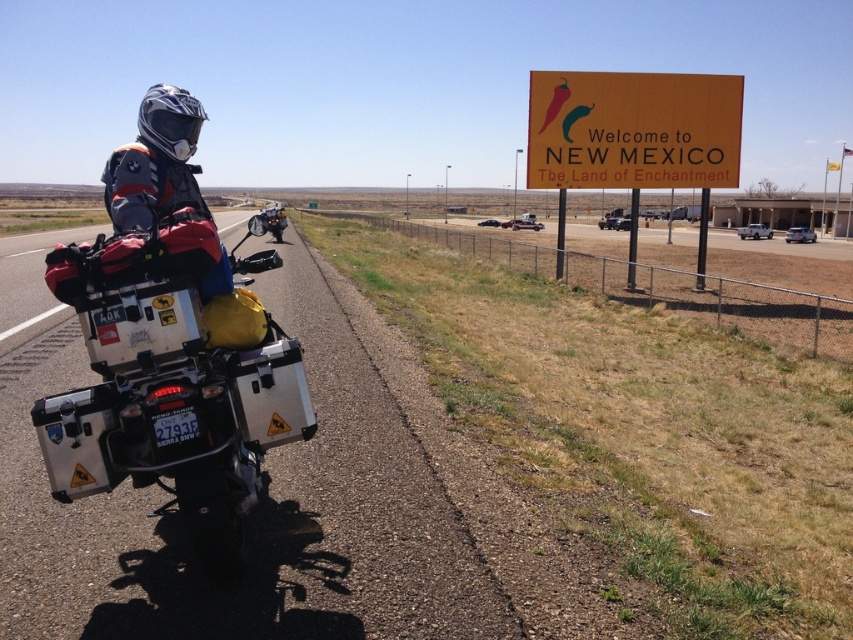
You are a traveler who just arrived in New Mexico. You see the metallic silver motorcycle at left and the yellow matte sign at upper right. How far apart are these two objects from each other?

The metallic silver motorcycle at left is 11.56 meters away from the yellow matte sign at upper right.

You are a driver approaching the yellow matte sign at upper right while driving on the highway. The distance between you and the sign is 19.48 meters. If your car is traveling at 60 km per hour, will you have enough time to slow down and read the sign before passing it?

The distance between the yellow matte sign at upper right and the viewer is 19.48 meters. At 60 km per hour, which converts to approximately 16.67 meters per second, it would take about 1.17 seconds to reach the sign. This provides sufficient time to safely slow down and read the sign before passing it.

You are a delivery driver who needs to pass through the highway scene shown. Your delivery truck is 15 feet long. Can you safely navigate between the silver metallic motorcycle at left and the matte black motorcycle at center without hitting either vehicle?

The distance between the silver metallic motorcycle at left and the matte black motorcycle at center is 13.22 feet. Since your truck is 15 feet long, it is longer than the available space between the motorcycles. Therefore, you cannot safely navigate between them without risking a collision.